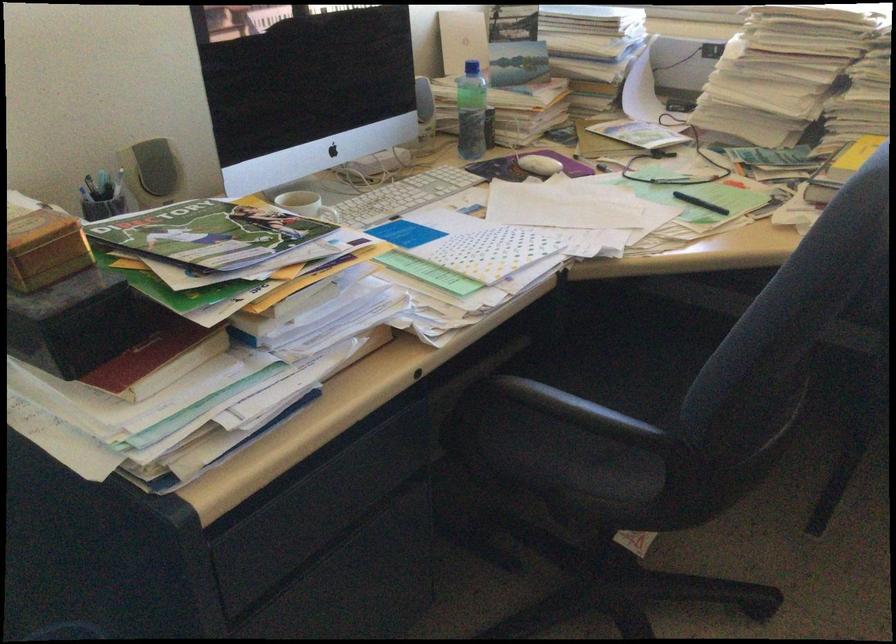
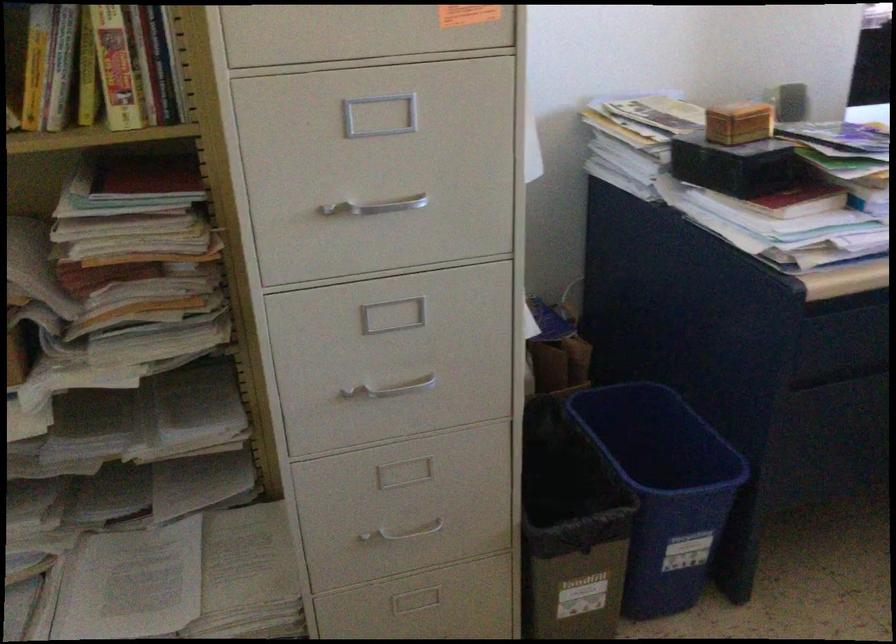
Question: The camera is either moving clockwise (left) or counter-clockwise (right) around the object. The first image is from the beginning of the video and the second image is from the end. Is the camera moving left or right when shooting the video?

Choices:
 (A) Left
 (B) Right

Answer: (B)